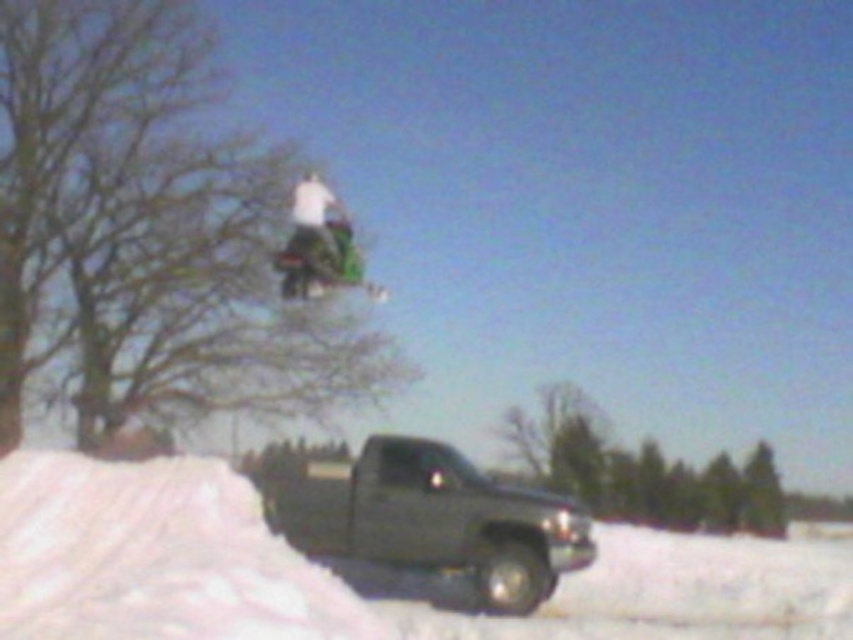
You are a delivery driver who needs to drive the matte black truck at lower center forward. However, you notice the green plastic snowboard at upper center is in the path. Can you safely move the truck forward without hitting the snowboard?

The matte black truck at lower center is in front of the green plastic snowboard at upper center, meaning the truck is closer to you. Since the truck is already positioned in front, you can safely move it forward without hitting the snowboard as it is not blocking the path.

You are standing at the point labeled as point (433,518) in the snowy scene. What object is located at that point?

The point labeled as point (433,518) corresponds to the matte black truck at lower center.